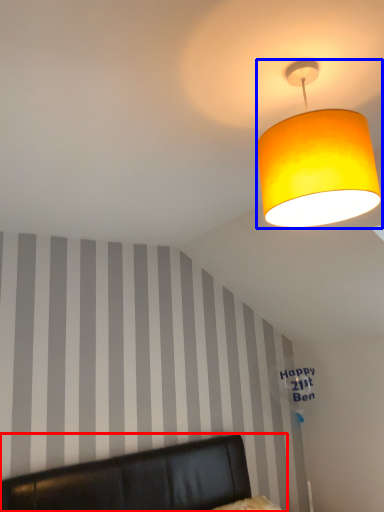
Question: Which object appears farthest to the camera in this image, furniture (highlighted by a red box) or lamp (highlighted by a blue box)?

Choices:
 (A) furniture
 (B) lamp

Answer: (B)